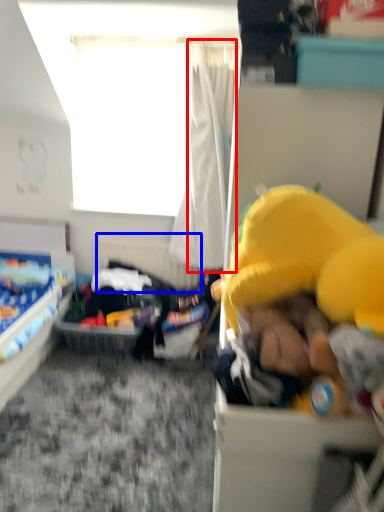
Question: Among these objects, which one is nearest to the camera, curtain (highlighted by a red box) or bed frame (highlighted by a blue box)?

Choices:
 (A) curtain
 (B) bed frame

Answer: (A)